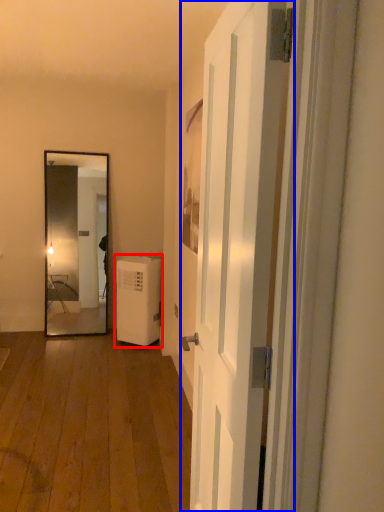
Question: Among these objects, which one is nearest to the camera, water heater (highlighted by a red box) or door (highlighted by a blue box)?

Choices:
 (A) water heater
 (B) door

Answer: (B)